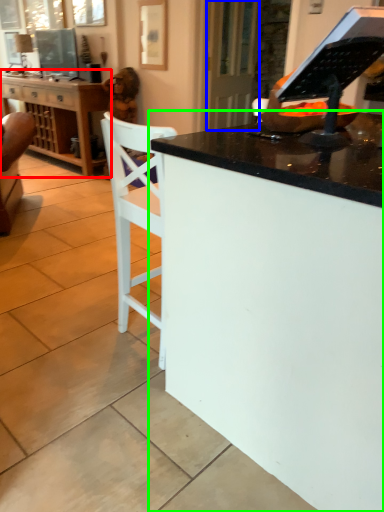
Question: Which is farther away from cabinetry (highlighted by a red box)? glass door (highlighted by a blue box) or desk (highlighted by a green box)?

Choices:
 (A) glass door
 (B) desk

Answer: (B)